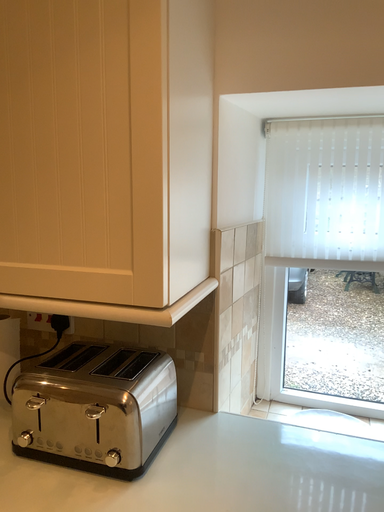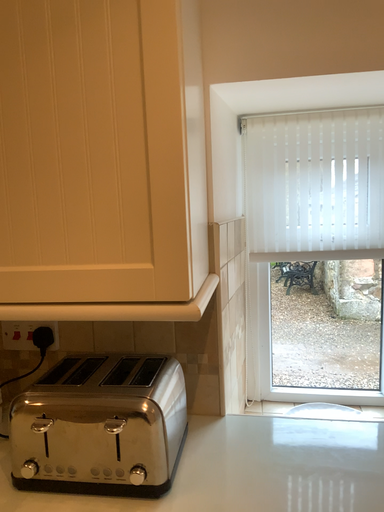
Question: How did the camera likely rotate when shooting the video?

Choices:
 (A) rotated right
 (B) rotated left

Answer: (A)